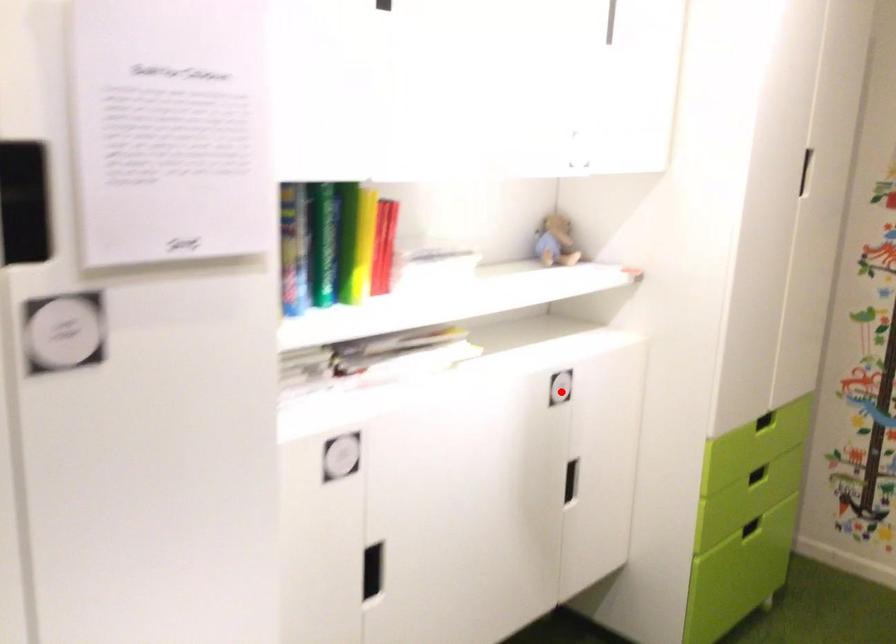
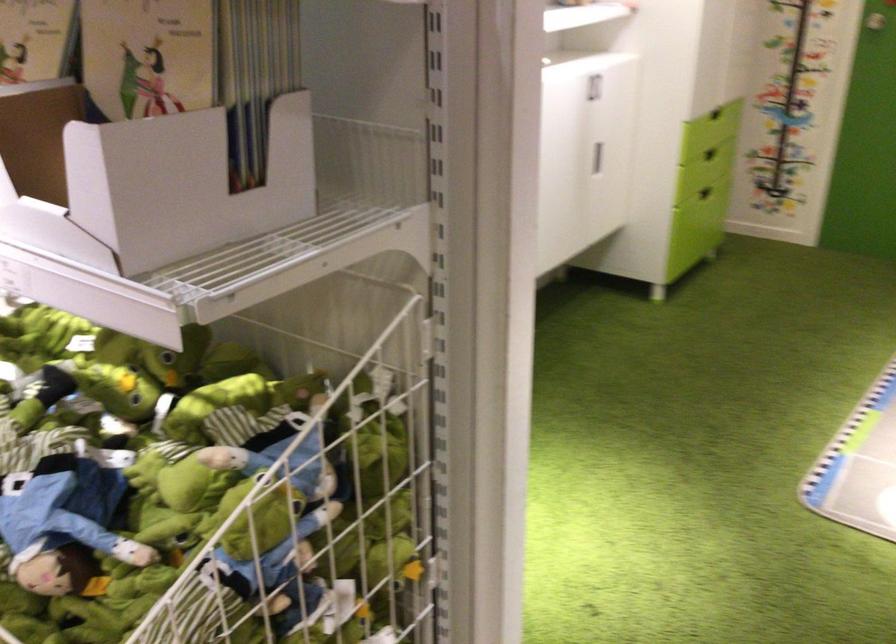
Where in the second image is the point corresponding to the highlighted location from the first image?

(593, 87)